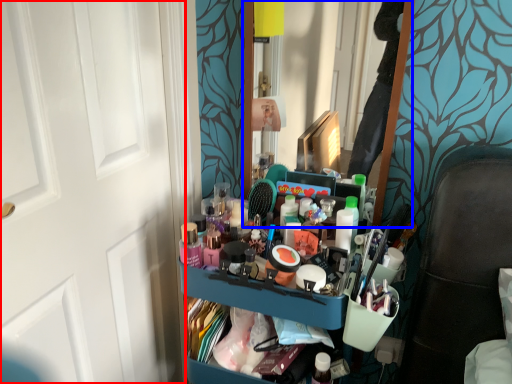
Question: Which point is closer to the camera, door (highlighted by a red box) or mirror (highlighted by a blue box)?

Choices:
 (A) door
 (B) mirror

Answer: (A)